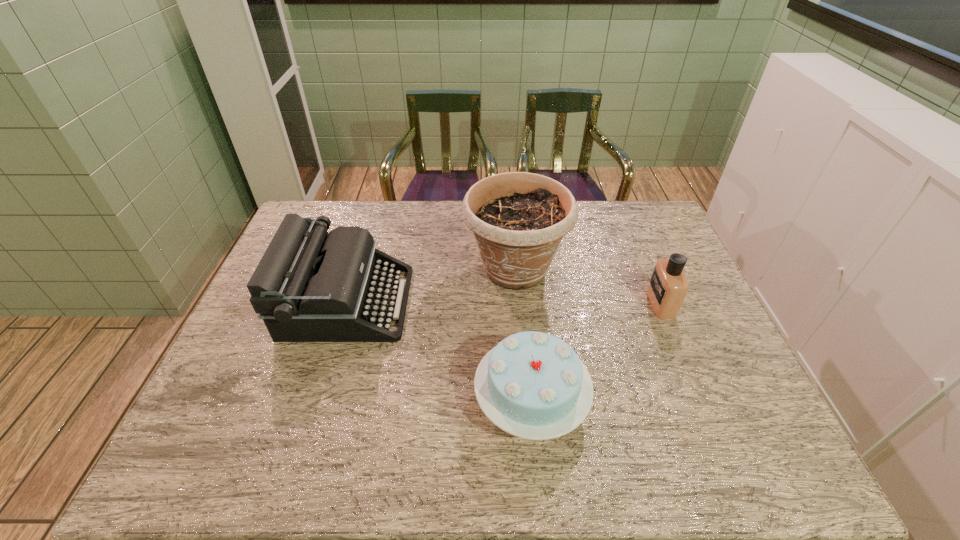
Where is `the tallest object`? The width and height of the screenshot is (960, 540). the tallest object is located at coordinates (518, 218).

Find the location of a particular element. The width and height of the screenshot is (960, 540). the leftmost object is located at coordinates (310, 286).

Find the location of a particular element. This screenshot has height=540, width=960. typewriter is located at coordinates (310, 286).

This screenshot has width=960, height=540. I want to click on the rightmost object, so pyautogui.click(x=668, y=286).

You are a GUI agent. You are given a task and a screenshot of the screen. Output one action in this format:
    pyautogui.click(x=<x>, y=<y>)
    Task: Click on the birthday cake
    This screenshot has width=960, height=540.
    Given the screenshot: What is the action you would take?
    pyautogui.click(x=533, y=385)

At what (x,y) coordinates should I click in order to perform the action: click on vacant space located on the back of the tallest object. Please return your answer as a coordinate pair (x, y). Looking at the image, I should click on (511, 222).

Find the location of a particular element. The width and height of the screenshot is (960, 540). free space located on the typing side of the typewriter is located at coordinates (491, 302).

The width and height of the screenshot is (960, 540). In order to click on vacant space located 0.100m on the front label of the rightmost object in this screenshot , I will do `click(615, 303)`.

Locate an element on the screen. This screenshot has height=540, width=960. vacant space situated on the front label of the rightmost object is located at coordinates (526, 303).

This screenshot has width=960, height=540. Identify the location of blank area located 0.220m on the front label of the rightmost object. (574, 303).